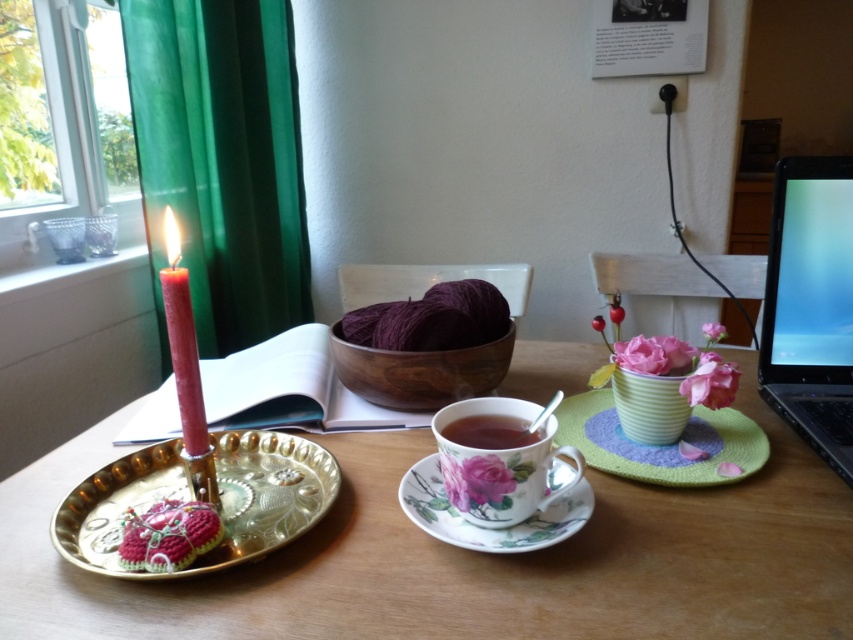
Question: Considering the relative positions of purple yarn at center and matte porcelain cup at center in the image provided, where is purple yarn at center located with respect to matte porcelain cup at center?

Choices:
 (A) left
 (B) right

Answer: (A)

Question: Which object appears closest to the camera in this image?

Choices:
 (A) sleek black laptop at right
 (B) green fabric curtain at left

Answer: (A)

Question: Which of the following is the closest to the observer?

Choices:
 (A) purple yarn at center
 (B) crochet fabric at center

Answer: (B)

Question: Is the position of crochet fabric at center less distant than that of red wax candle at left?

Choices:
 (A) yes
 (B) no

Answer: (B)

Question: Can you confirm if sleek black laptop at right is smaller than green textured placemat at center?

Choices:
 (A) yes
 (B) no

Answer: (B)

Question: Estimate the real-world distances between objects in this image. Which object is closer to the gold metallic platter at left?

Choices:
 (A) floral porcelain saucer at center
 (B) purple yarn at center
 (C) crochet fabric at center
 (D) green textured placemat at center

Answer: (C)